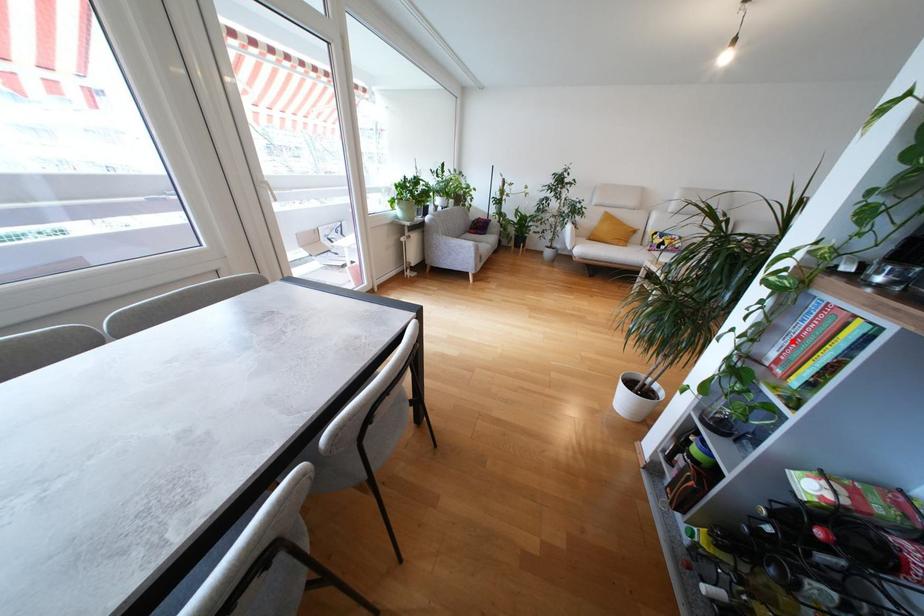
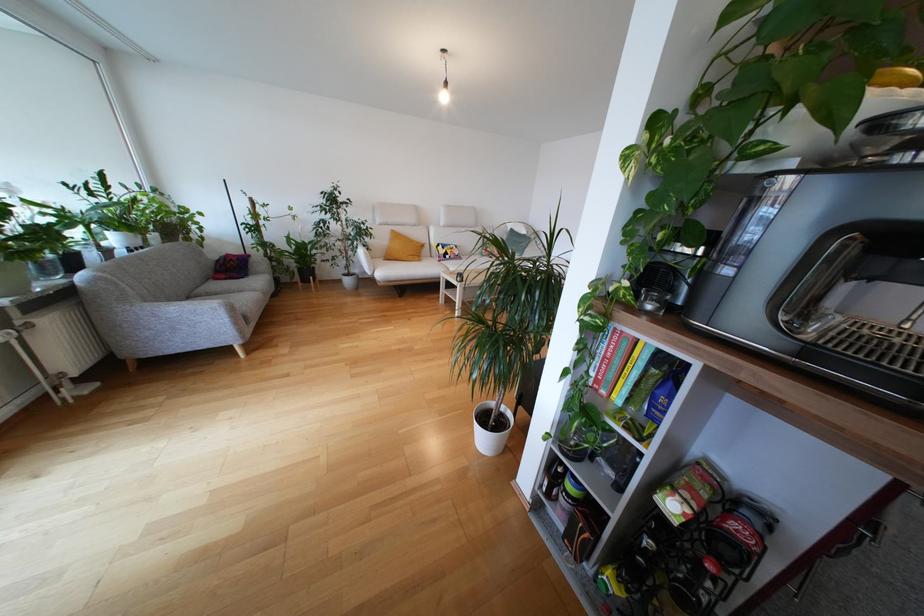
The point at the highlighted location is marked in the first image. Where is the corresponding point in the second image?

(601, 361)